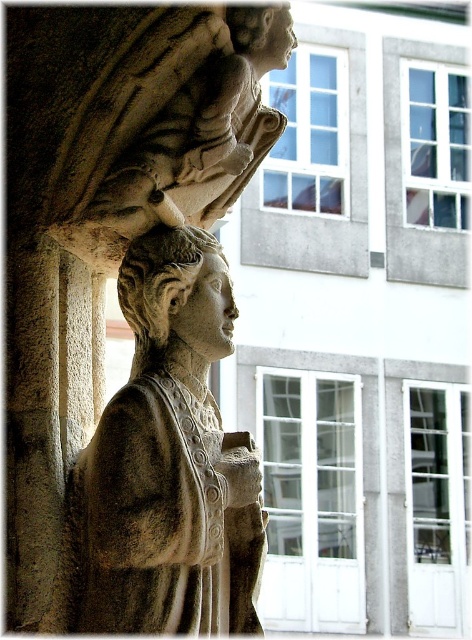
What is located at the coordinates point (160, 280) in the image?

The gray stone head at center is located at point (160, 280).

What are the coordinates of the gray stone head at center in the image?

The gray stone head at center is located at coordinates point (160, 280).